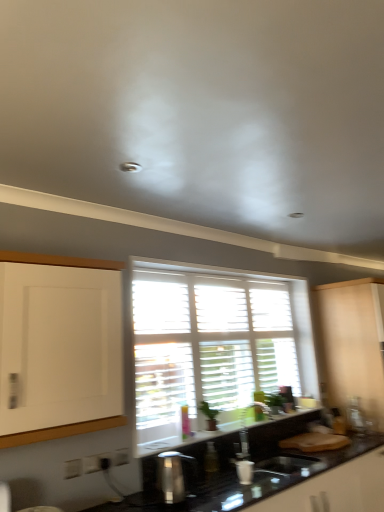
Question: Can you confirm if metallic silver toaster at right, which is counted as the 1th appliance, starting from the back, is smaller than white wooden blinds at center?

Choices:
 (A) yes
 (B) no

Answer: (A)

Question: Can you confirm if metallic silver toaster at right, which is counted as the 1th appliance, starting from the back, is positioned to the right of white wooden blinds at center?

Choices:
 (A) yes
 (B) no

Answer: (A)

Question: Is metallic silver toaster at right, the second appliance from the left, outside of white wooden blinds at center?

Choices:
 (A) no
 (B) yes

Answer: (B)

Question: Does metallic silver toaster at right, which is counted as the 1th appliance, starting from the back, appear on the left side of white wooden blinds at center?

Choices:
 (A) no
 (B) yes

Answer: (A)

Question: Could you tell me if metallic silver toaster at right, the second appliance in the front-to-back sequence, is facing white wooden blinds at center?

Choices:
 (A) yes
 (B) no

Answer: (B)

Question: Can you confirm if metallic silver toaster at right, which is the 1th appliance in right-to-left order, is thinner than white wooden blinds at center?

Choices:
 (A) no
 (B) yes

Answer: (B)

Question: Can you confirm if beige matte cabinet at right is taller than white wooden blinds at center?

Choices:
 (A) yes
 (B) no

Answer: (A)

Question: Considering the relative positions of beige matte cabinet at right and white wooden blinds at center in the image provided, is beige matte cabinet at right behind white wooden blinds at center?

Choices:
 (A) yes
 (B) no

Answer: (A)

Question: From a real-world perspective, does beige matte cabinet at right stand above white wooden blinds at center?

Choices:
 (A) yes
 (B) no

Answer: (B)

Question: From the image's perspective, would you say beige matte cabinet at right is shown under white wooden blinds at center?

Choices:
 (A) no
 (B) yes

Answer: (B)

Question: Is beige matte cabinet at right thinner than white wooden blinds at center?

Choices:
 (A) yes
 (B) no

Answer: (B)

Question: Considering the relative positions of beige matte cabinet at right and white wooden blinds at center in the image provided, is beige matte cabinet at right to the left of white wooden blinds at center from the viewer's perspective?

Choices:
 (A) yes
 (B) no

Answer: (B)

Question: Does white wooden blinds at center have a greater width compared to beige matte cabinet at right?

Choices:
 (A) yes
 (B) no

Answer: (B)